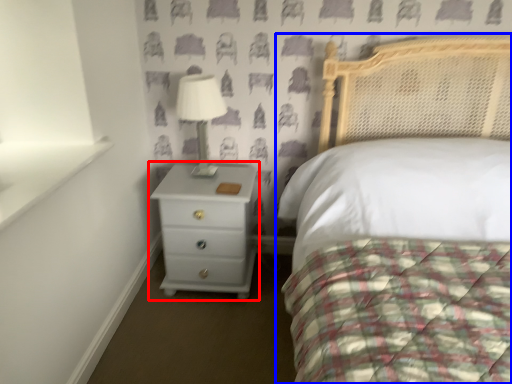
Question: Which object is closer to the camera taking this photo, chest of drawers (highlighted by a red box) or bed (highlighted by a blue box)?

Choices:
 (A) chest of drawers
 (B) bed

Answer: (B)